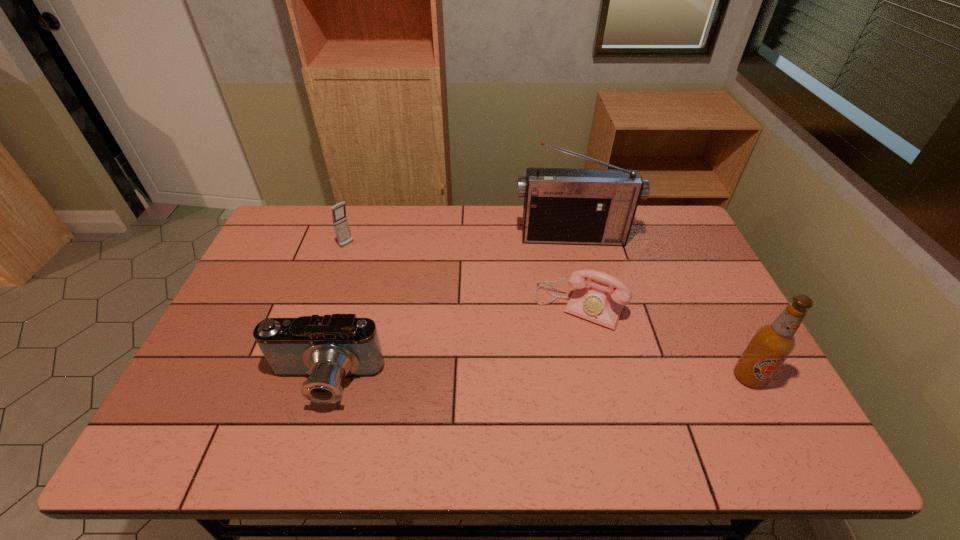
You are a GUI agent. You are given a task and a screenshot of the screen. Output one action in this format:
    pyautogui.click(x=<x>, y=<y>)
    Task: Click on the object present at the right edge
    The width and height of the screenshot is (960, 540).
    Given the screenshot: What is the action you would take?
    pyautogui.click(x=772, y=344)

Where is `object that is positioned at the near right corner`? object that is positioned at the near right corner is located at coordinates (772, 344).

The height and width of the screenshot is (540, 960). In order to click on free space at the far edge of the desktop in this screenshot , I will do `click(452, 223)`.

Locate an element on the screen. The image size is (960, 540). vacant region at the near edge of the desktop is located at coordinates (287, 406).

At what (x,y) coordinates should I click in order to perform the action: click on vacant space at the left edge. Please return your answer as a coordinate pair (x, y). Image resolution: width=960 pixels, height=540 pixels. Looking at the image, I should click on (302, 250).

Find the location of a particular element. free space at the right edge of the desktop is located at coordinates (719, 314).

At what (x,y) coordinates should I click in order to perform the action: click on free space at the far left corner of the desktop. Please return your answer as a coordinate pair (x, y). Looking at the image, I should click on (278, 237).

At what (x,y) coordinates should I click in order to perform the action: click on free space at the near left corner. Please return your answer as a coordinate pair (x, y). The width and height of the screenshot is (960, 540). Looking at the image, I should click on (180, 397).

Locate an element on the screen. This screenshot has width=960, height=540. blank space at the far right corner of the desktop is located at coordinates (681, 226).

This screenshot has width=960, height=540. I want to click on free space between the beer bottle and the telephone, so click(664, 341).